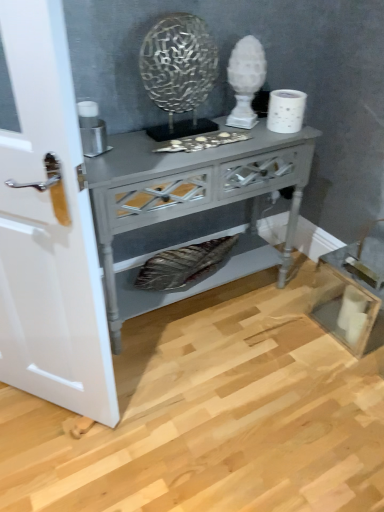
Where is `free space above matte gray wooden nightstand at center (from a real-world perspective)`? free space above matte gray wooden nightstand at center (from a real-world perspective) is located at coordinates (183, 146).